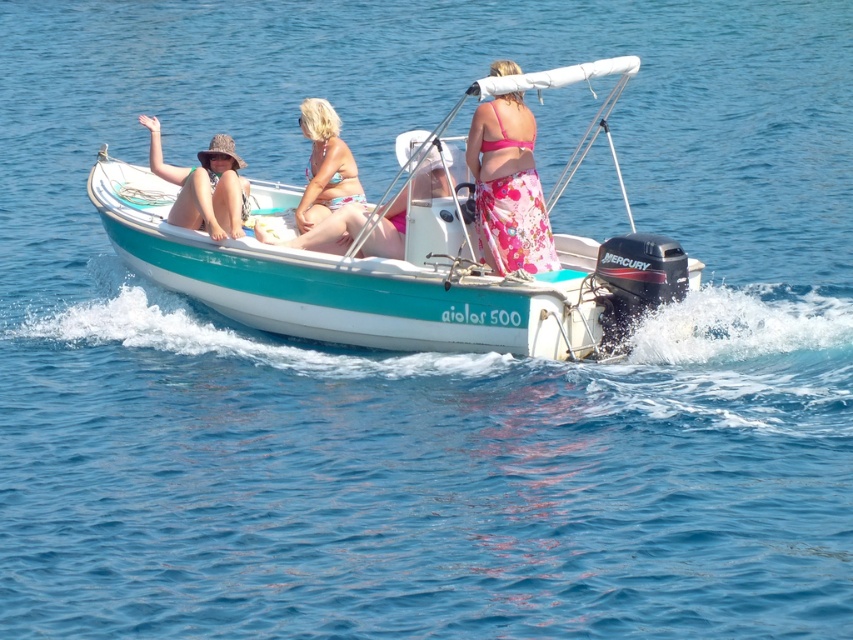
Question: Can you confirm if pink floral skirt at center is positioned below matte straw hat at left?

Choices:
 (A) yes
 (B) no

Answer: (A)

Question: Is pink floral skirt at center further to the viewer compared to pink bikini at center?

Choices:
 (A) no
 (B) yes

Answer: (A)

Question: Which of the following is the closest to the observer?

Choices:
 (A) pink floral skirt at center
 (B) pink bikini at center
 (C) teal glossy boat at center
 (D) matte straw hat at left

Answer: (C)

Question: Which point appears farthest from the camera in this image?

Choices:
 (A) (541, 284)
 (B) (494, 253)
 (C) (247, 182)
 (D) (331, 196)

Answer: (C)

Question: Is teal glossy boat at center bigger than matte straw hat at left?

Choices:
 (A) yes
 (B) no

Answer: (A)

Question: Which is nearer to the matte straw hat at left?

Choices:
 (A) teal glossy boat at center
 (B) pink floral skirt at center
 (C) pink bikini at center

Answer: (C)